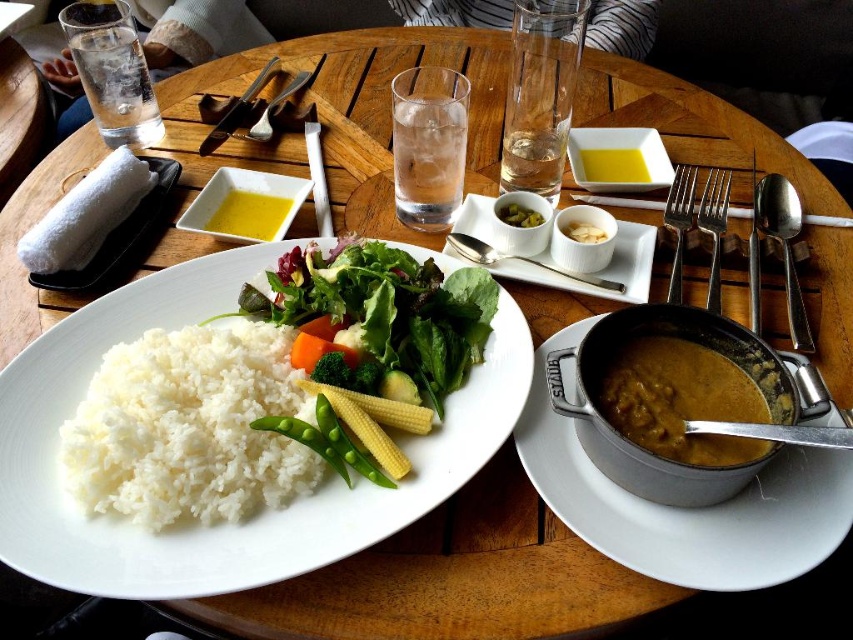
Question: Among these objects, which one is nearest to the camera?

Choices:
 (A) white matte rice at left
 (B) green matte peas at center
 (C) white ceramic square plate at center

Answer: (A)

Question: Which object appears farthest from the camera in this image?

Choices:
 (A) yellow matte square bowl at upper left
 (B) yellow matte bowl at center
 (C) green pickled vegetables at center

Answer: (B)

Question: Is white matte rice at left thinner than yellowish-brown creamy soup at lower right?

Choices:
 (A) no
 (B) yes

Answer: (A)

Question: Does matte silver bowl at center appear over white ceramic bowl at center?

Choices:
 (A) yes
 (B) no

Answer: (B)

Question: Among these objects, which one is nearest to the camera?

Choices:
 (A) white matte plate at center
 (B) yellow matte bowl at center
 (C) silver metallic fork at center right

Answer: (A)

Question: Is the position of yellow liquid oil at upper center less distant than that of green pickled vegetables at center?

Choices:
 (A) no
 (B) yes

Answer: (B)